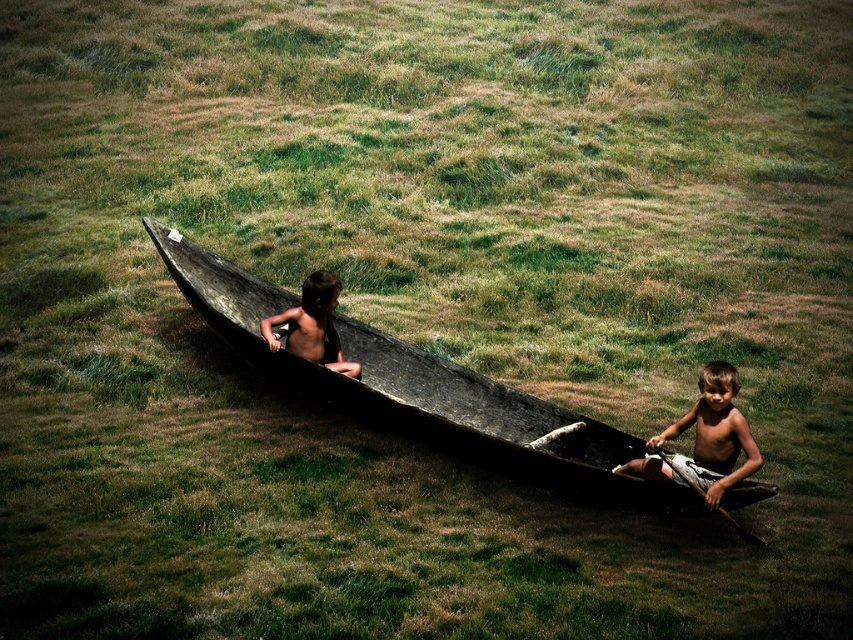
You are a photographer trying to capture both the dark wood canoe at center and the light brown wooden boat at lower right in a single frame. Based on their sizes, which object should you position closer to the camera to ensure both fit in the frame?

The dark wood canoe at center is larger in size than the light brown wooden boat at lower right. To ensure both fit in the frame, position the larger dark wood canoe at center closer to the camera and the smaller light brown wooden boat at lower right further back.